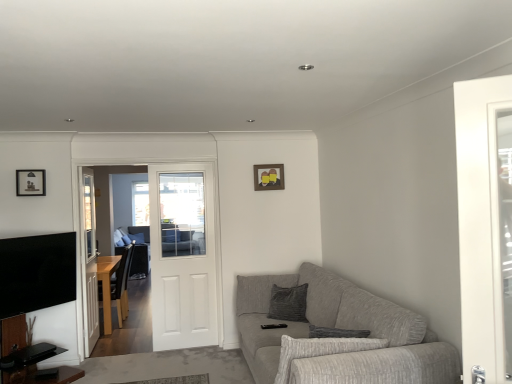
The height and width of the screenshot is (384, 512). I want to click on black glossy tv at left, so click(x=37, y=272).

What do you see at coordinates (341, 328) in the screenshot? The width and height of the screenshot is (512, 384). I see `textured gray couch at lower right` at bounding box center [341, 328].

This screenshot has height=384, width=512. Identify the location of textured gray couch at lower right. (341, 328).

Image resolution: width=512 pixels, height=384 pixels. What do you see at coordinates (269, 177) in the screenshot? I see `wooden photo frame at upper center, the first picture frame when ordered from right to left` at bounding box center [269, 177].

What do you see at coordinates (31, 182) in the screenshot? This screenshot has height=384, width=512. I see `matte black picture frame at upper left, the first picture frame from the front` at bounding box center [31, 182].

The width and height of the screenshot is (512, 384). In order to click on white wooden door at center in this screenshot , I will do `click(182, 256)`.

The width and height of the screenshot is (512, 384). In order to click on gray fabric couch at center in this screenshot , I will do `click(139, 233)`.

Consider the image. From the image's perspective, is white wooden door at center above or below matte black picture frame at upper left, the first picture frame from the front?

white wooden door at center is below matte black picture frame at upper left, the first picture frame from the front.

Is matte black picture frame at upper left, the second picture frame viewed from the right, at the back of white wooden door at center?

white wooden door at center is not turned away from matte black picture frame at upper left, the second picture frame viewed from the right.

Does point (175, 309) come in front of point (42, 189)?

No, it is not.

Which of these two, white wooden door at center or matte black picture frame at upper left, the second picture frame when ordered from back to front, is smaller?

Smaller between the two is matte black picture frame at upper left, the second picture frame when ordered from back to front.

From the image's perspective, which object appears higher, brown wooden chair at left or clear glass door at left?

clear glass door at left is shown above in the image.

In the image, is brown wooden chair at left positioned in front of or behind clear glass door at left?

brown wooden chair at left is behind clear glass door at left.

How far apart are brown wooden chair at left and clear glass door at left?

A distance of 12.08 inches exists between brown wooden chair at left and clear glass door at left.

Is brown wooden chair at left oriented towards clear glass door at left?

No.

From a real-world perspective, which object stands above the other?

wooden photo frame at upper center, the first picture frame when ordered from right to left.

Looking at this image, is textured gray couch at lower right taller than wooden photo frame at upper center, the 2th picture frame when ordered from left to right?

Yes, textured gray couch at lower right is taller than wooden photo frame at upper center, the 2th picture frame when ordered from left to right.

From the picture: Is textured gray couch at lower right in front of or behind wooden photo frame at upper center, the second picture frame viewed from the front, in the image?

Clearly, textured gray couch at lower right is in front of wooden photo frame at upper center, the second picture frame viewed from the front.

Which is more to the right, textured gray couch at lower right or wooden photo frame at upper center, the 2th picture frame when ordered from left to right?

Positioned to the right is textured gray couch at lower right.

Is gray fabric couch at center positioned far away from white wooden door at center?

Yes, gray fabric couch at center is far from white wooden door at center.

Would you say gray fabric couch at center is outside white wooden door at center?

Indeed, gray fabric couch at center is completely outside white wooden door at center.

You are a GUI agent. You are given a task and a screenshot of the screen. Output one action in this format:
    pyautogui.click(x=<x>, y=<y>)
    Task: Click on the door positioned vertically above the gray fabric couch at center (from a real-world perspective)
    
    Given the screenshot: What is the action you would take?
    pyautogui.click(x=182, y=256)

Is white wooden door at center at the back of gray fabric couch at center?

No, gray fabric couch at center's orientation is not away from white wooden door at center.

Is gray fabric couch at center positioned far away from brown wooden chair at left?

Indeed, gray fabric couch at center is not near brown wooden chair at left.

Considering the relative positions of gray fabric couch at center and brown wooden chair at left in the image provided, is gray fabric couch at center to the left or to the right of brown wooden chair at left?

Clearly, gray fabric couch at center is on the left of brown wooden chair at left in the image.

Can you confirm if gray fabric couch at center is thinner than brown wooden chair at left?

Incorrect, the width of gray fabric couch at center is not less than that of brown wooden chair at left.

Considering the relative positions of gray fabric couch at center and brown wooden chair at left in the image provided, is gray fabric couch at center behind brown wooden chair at left?

Yes, gray fabric couch at center is behind brown wooden chair at left.

Does textured gray couch at lower right have a greater width compared to matte black picture frame at upper left, the second picture frame when ordered from back to front?

Yes, textured gray couch at lower right is wider than matte black picture frame at upper left, the second picture frame when ordered from back to front.

Is textured gray couch at lower right looking in the opposite direction of matte black picture frame at upper left, the second picture frame when ordered from back to front?

textured gray couch at lower right does not have its back to matte black picture frame at upper left, the second picture frame when ordered from back to front.

From a real-world perspective, is textured gray couch at lower right located beneath matte black picture frame at upper left, the second picture frame viewed from the right?

Yes, from a real-world perspective, textured gray couch at lower right is below matte black picture frame at upper left, the second picture frame viewed from the right.

Which is more to the left, textured gray couch at lower right or matte black picture frame at upper left, which is the 1th picture frame from left to right?

Positioned to the left is matte black picture frame at upper left, which is the 1th picture frame from left to right.

Considering the sizes of objects brown wooden chair at left and textured gray couch at lower right in the image provided, who is shorter, brown wooden chair at left or textured gray couch at lower right?

Standing shorter between the two is textured gray couch at lower right.

Measure the distance between brown wooden chair at left and textured gray couch at lower right.

They are 2.23 meters apart.

Between brown wooden chair at left and textured gray couch at lower right, which one has larger width?

textured gray couch at lower right.

From a real-world perspective, is brown wooden chair at left on top of textured gray couch at lower right?

Indeed, from a real-world perspective, brown wooden chair at left stands above textured gray couch at lower right.

From the image's perspective, which picture frame is the 1st one above the white wooden door at center? Please provide its 2D coordinates.

[(31, 182)]

The width and height of the screenshot is (512, 384). Identify the location of chair below the clear glass door at left (from a real-world perspective). (114, 285).

Which object lies further to the anchor point white wooden door at center, textured gray couch at lower right or gray fabric couch at center?

gray fabric couch at center is positioned further to the anchor white wooden door at center.

From the image, which object appears to be farther from white wooden door at center, clear glass door at left or black glossy tv at left?

black glossy tv at left.

Estimate the real-world distances between objects in this image. Which object is further from wooden photo frame at upper center, the second picture frame viewed from the front, clear glass door at left or black glossy tv at left?

black glossy tv at left lies further to wooden photo frame at upper center, the second picture frame viewed from the front, than the other object.

Considering their positions, is matte black picture frame at upper left, the second picture frame viewed from the right, positioned further to clear glass door at left than brown wooden chair at left?

matte black picture frame at upper left, the second picture frame viewed from the right, lies further to clear glass door at left than the other object.

From the image, which object appears to be nearer to white wooden door at center, clear glass door at left or gray fabric couch at center?

clear glass door at left.

When comparing their distances from white wooden door at center, does brown wooden chair at left or clear glass door at left seem further?

clear glass door at left.

From the image, which object appears to be farther from wooden photo frame at upper center, the second picture frame viewed from the front, brown wooden chair at left or clear glass door at left?

brown wooden chair at left.

When comparing their distances from brown wooden chair at left, does white wooden door at center or black glossy tv at left seem further?

Based on the image, white wooden door at center appears to be further to brown wooden chair at left.

Locate an element on the screen. The image size is (512, 384). television between matte black picture frame at upper left, which is the 1th picture frame from left to right, and textured gray couch at lower right, in the horizontal direction is located at coordinates (37, 272).

Identify the location of door situated between black glossy tv at left and textured gray couch at lower right from left to right. The height and width of the screenshot is (384, 512). (182, 256).

The width and height of the screenshot is (512, 384). In order to click on screen door situated between matte black picture frame at upper left, which is the 1th picture frame from left to right, and wooden photo frame at upper center, the 2th picture frame when ordered from left to right, from left to right in this screenshot , I will do `click(89, 260)`.

The image size is (512, 384). Find the location of `television between textured gray couch at lower right and brown wooden chair at left in the front-back direction`. television between textured gray couch at lower right and brown wooden chair at left in the front-back direction is located at coordinates (37, 272).